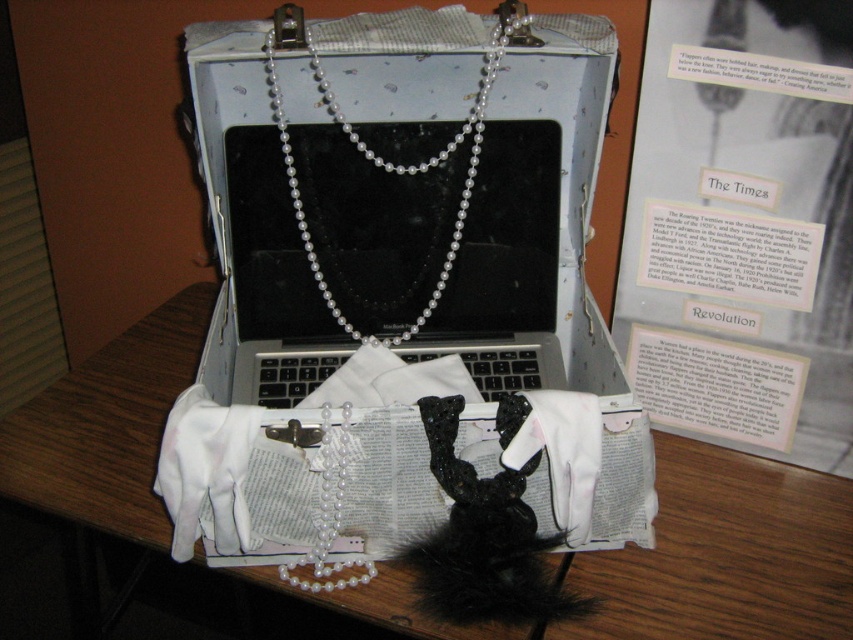
You are a delivery person who needs to place a 28.5 inch package between the two points marked as point (502, 637) and another point. Will the package fit between them?

The distance between the two points is 28.23 inches. Since the package is 28.5 inches, which is slightly longer, it will not fit between them.